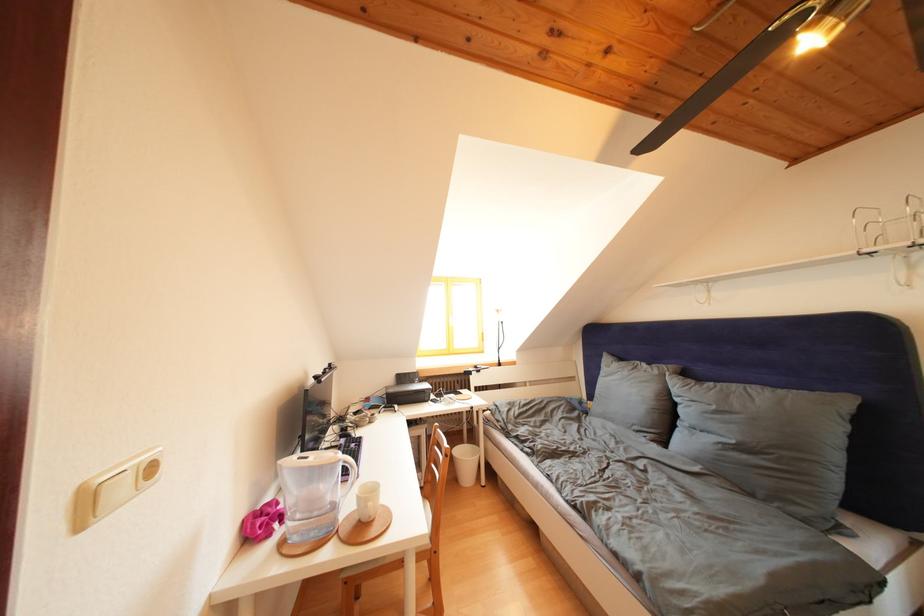
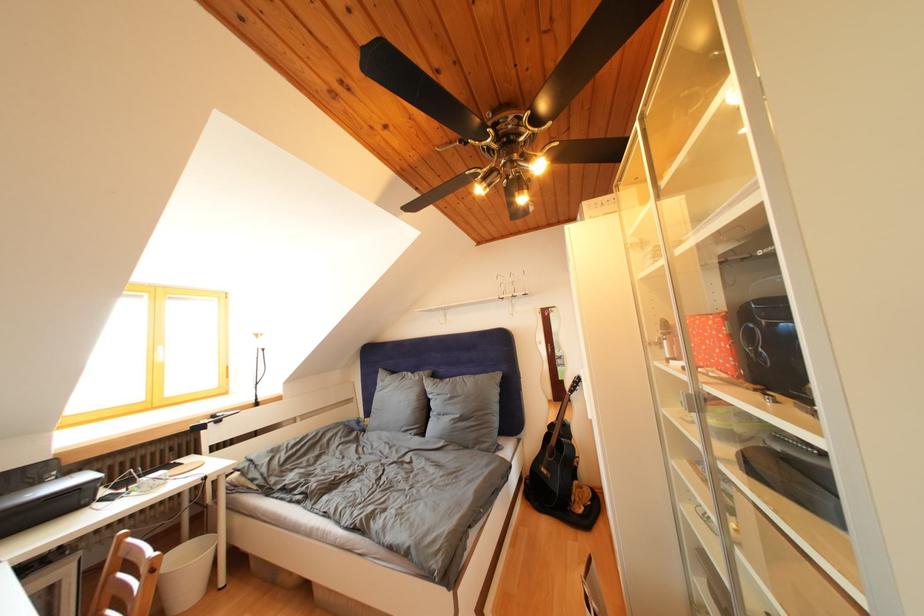
Find the pixel in the second image that matches (629,363) in the first image.

(400, 378)